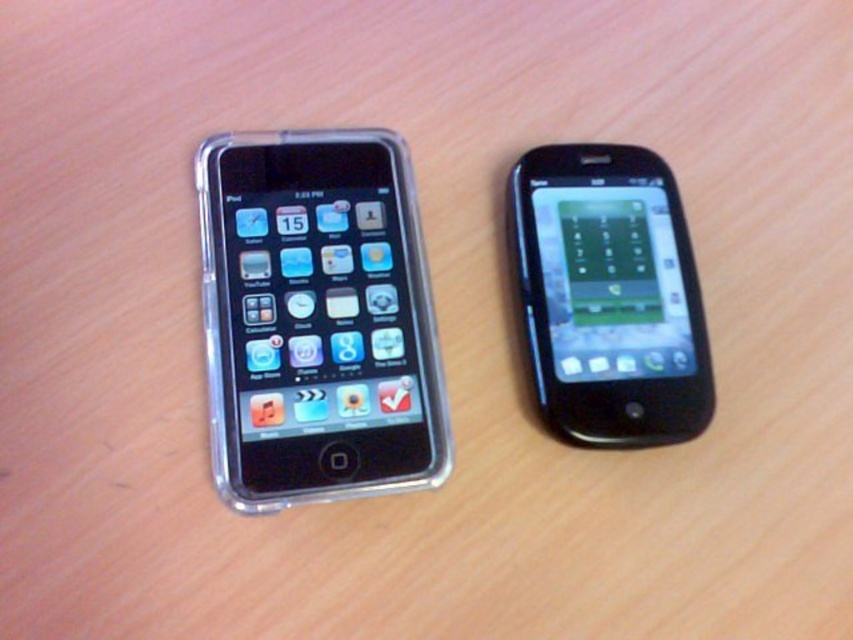
Question: Is clear plastic phone at left wider than black glossy smartphone at right?

Choices:
 (A) yes
 (B) no

Answer: (A)

Question: Can you confirm if clear plastic phone at left is smaller than black glossy smartphone at right?

Choices:
 (A) no
 (B) yes

Answer: (A)

Question: Considering the relative positions of clear plastic phone at left and black glossy smartphone at right in the image provided, where is clear plastic phone at left located with respect to black glossy smartphone at right?

Choices:
 (A) below
 (B) above

Answer: (A)

Question: Which point is closer to the camera?

Choices:
 (A) clear plastic phone at left
 (B) black glossy smartphone at right

Answer: (A)

Question: Which of the following is the farthest from the observer?

Choices:
 (A) (372, 348)
 (B) (709, 374)

Answer: (A)